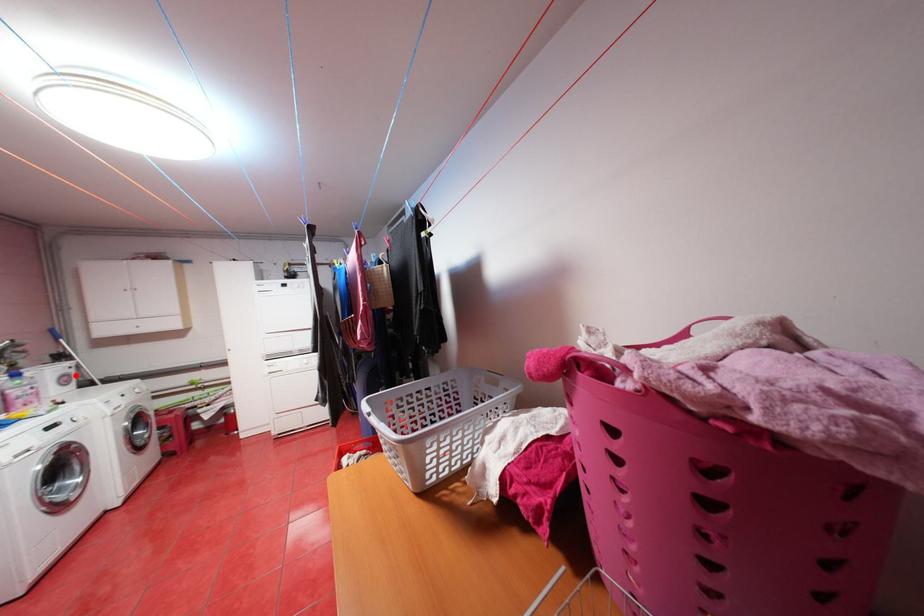
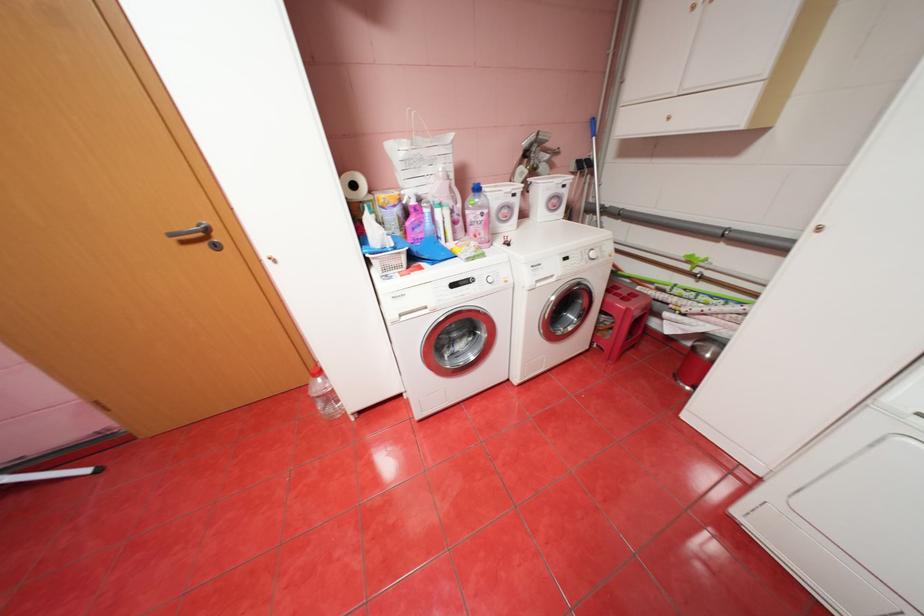
Find the pixel in the second image that matches the highlighted location in the first image.

(566, 197)